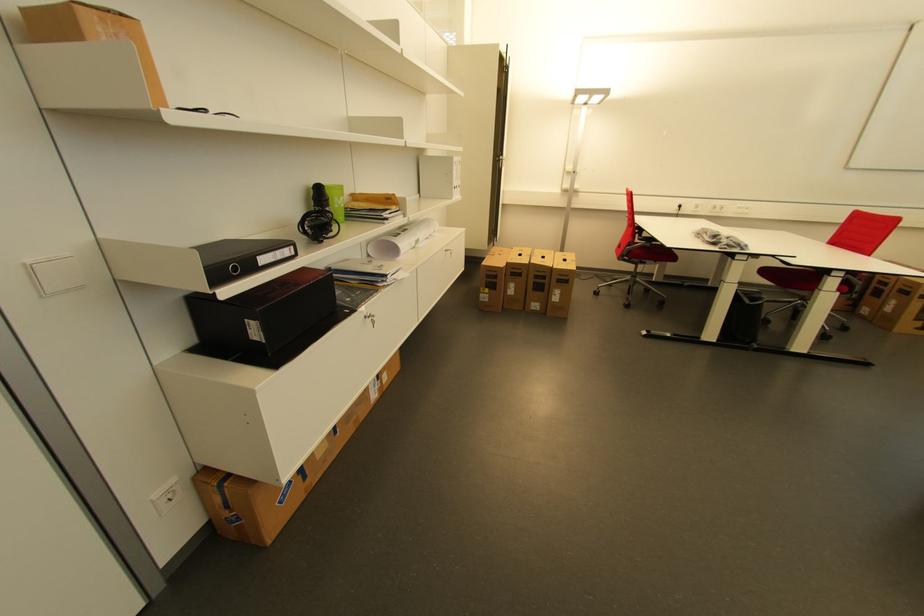
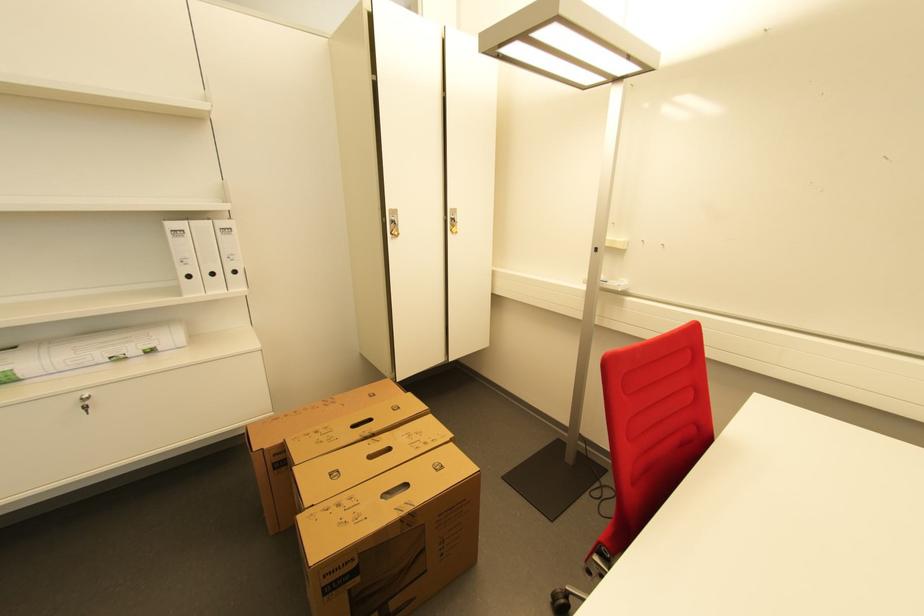
The point at (440, 233) is marked in the first image. Where is the corresponding point in the second image?

(155, 352)